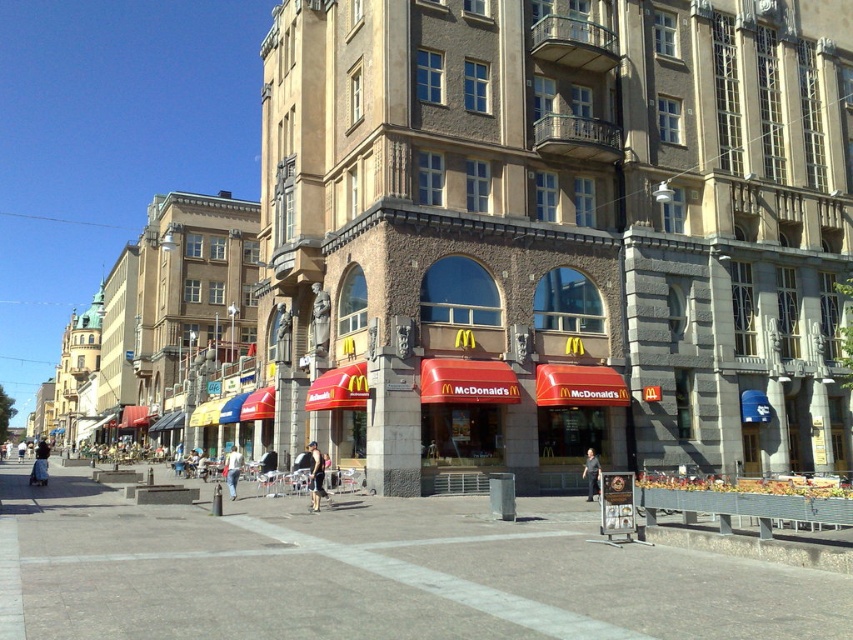
Between point (309, 481) and point (590, 483), which one is positioned in front?

Point (590, 483)

Where is `black fabric shorts at center`? black fabric shorts at center is located at coordinates (315, 476).

In order to click on black fabric shorts at center in this screenshot , I will do `click(315, 476)`.

Describe the element at coordinates (315, 476) in the screenshot. This screenshot has width=853, height=640. I see `black fabric shorts at center` at that location.

Who is lower down, black fabric shorts at center or denim shorts at center?

denim shorts at center is lower down.

The height and width of the screenshot is (640, 853). What are the coordinates of `black fabric shorts at center` in the screenshot? It's located at (315, 476).

Where is `black fabric shorts at center`? black fabric shorts at center is located at coordinates (315, 476).

Is concrete plaza at center shorter than black fabric shorts at center?

No, concrete plaza at center is not shorter than black fabric shorts at center.

Is concrete plaza at center smaller than black fabric shorts at center?

Actually, concrete plaza at center might be larger than black fabric shorts at center.

The image size is (853, 640). In order to click on concrete plaza at center in this screenshot , I will do `click(372, 573)`.